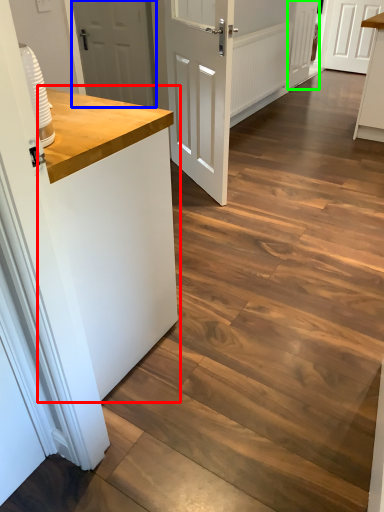
Question: Estimate the real-world distances between objects in this image. Which object is closer to counter top (highlighted by a red box), door (highlighted by a blue box) or door (highlighted by a green box)?

Choices:
 (A) door
 (B) door

Answer: (A)